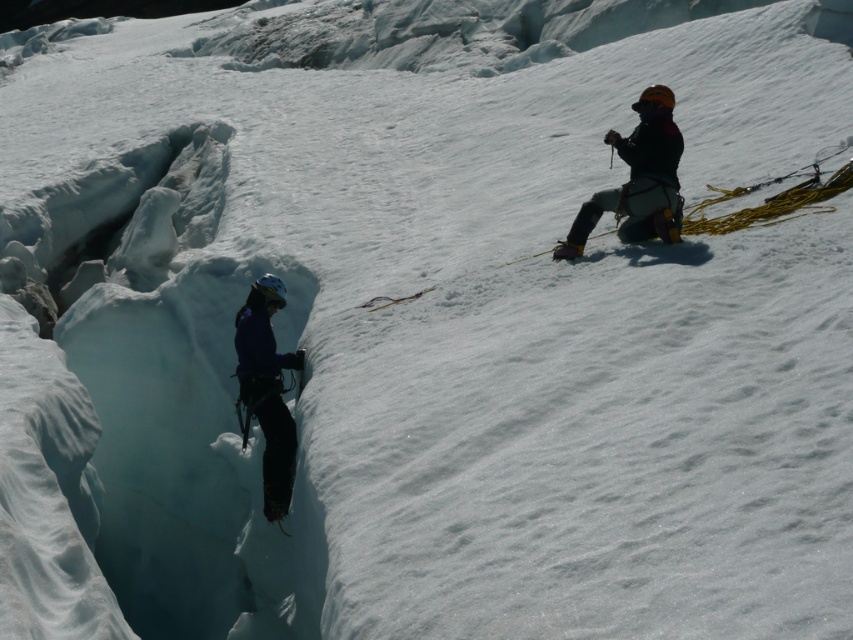
Can you confirm if dark blue fabric jacket at right is shorter than blue fabric jacket at left?

Yes, dark blue fabric jacket at right is shorter than blue fabric jacket at left.

Is dark blue fabric jacket at right closer to the viewer compared to blue fabric jacket at left?

Yes, it is in front of blue fabric jacket at left.

Locate an element on the screen. The width and height of the screenshot is (853, 640). dark blue fabric jacket at right is located at coordinates (637, 179).